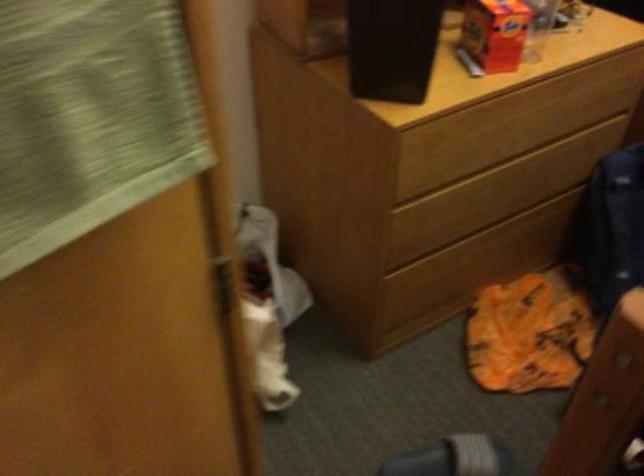
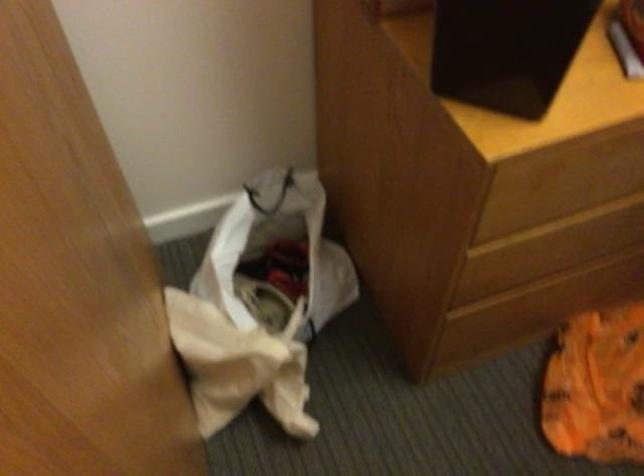
In the second image, find the point that corresponds to point 466,183 in the first image.

(585, 216)